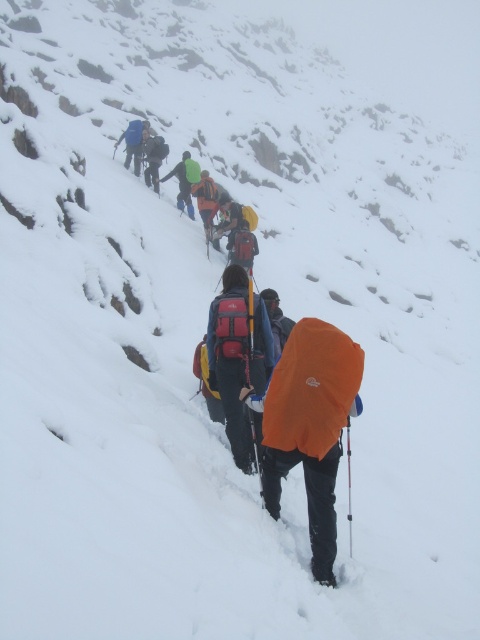
Which is behind, point (220, 225) or point (205, 221)?

The point (205, 221) is behind.

Between orange fabric jacket at center and orange fabric backpack at center, which one is positioned lower?

orange fabric jacket at center is below.

I want to click on orange fabric jacket at center, so click(x=227, y=218).

You are a GUI agent. You are given a task and a screenshot of the screen. Output one action in this format:
    pyautogui.click(x=<x>, y=<y>)
    Task: Click on the orange fabric jacket at center
    The width and height of the screenshot is (480, 640).
    Given the screenshot: What is the action you would take?
    pyautogui.click(x=227, y=218)

Is orange fabric jacket at center smaller than dark blue jacket at upper center?

Incorrect, orange fabric jacket at center is not smaller in size than dark blue jacket at upper center.

Which is more to the left, orange fabric jacket at center or dark blue jacket at upper center?

dark blue jacket at upper center is more to the left.

Who is more forward, (230,236) or (154,157)?

Point (230,236) is more forward.

At what (x,y) coordinates should I click in order to perform the action: click on orange fabric jacket at center. Please return your answer as a coordinate pair (x, y). Looking at the image, I should click on [227, 218].

Consider the image. Does green fabric jacket at center have a greater height compared to matte blue backpack at upper center?

No.

Who is shorter, green fabric jacket at center or matte blue backpack at upper center?

green fabric jacket at center is shorter.

Does point (184, 196) come in front of point (136, 128)?

Yes.

Image resolution: width=480 pixels, height=640 pixels. I want to click on green fabric jacket at center, so click(x=184, y=180).